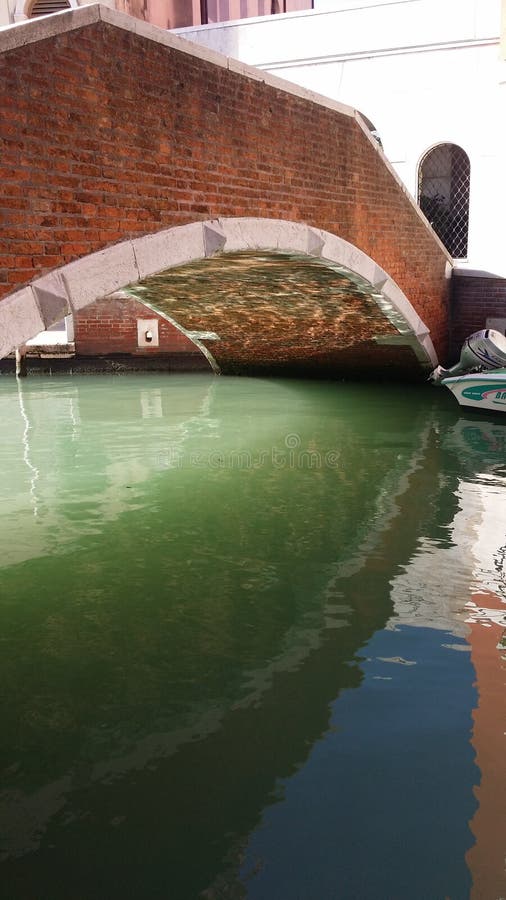
You are a GUI agent. You are given a task and a screenshot of the screen. Output one action in this format:
    pyautogui.click(x=<x>, y=<y>)
    Task: Click on the window
    Image resolution: width=506 pixels, height=900 pixels.
    Given the screenshot: What is the action you would take?
    pyautogui.click(x=444, y=182)